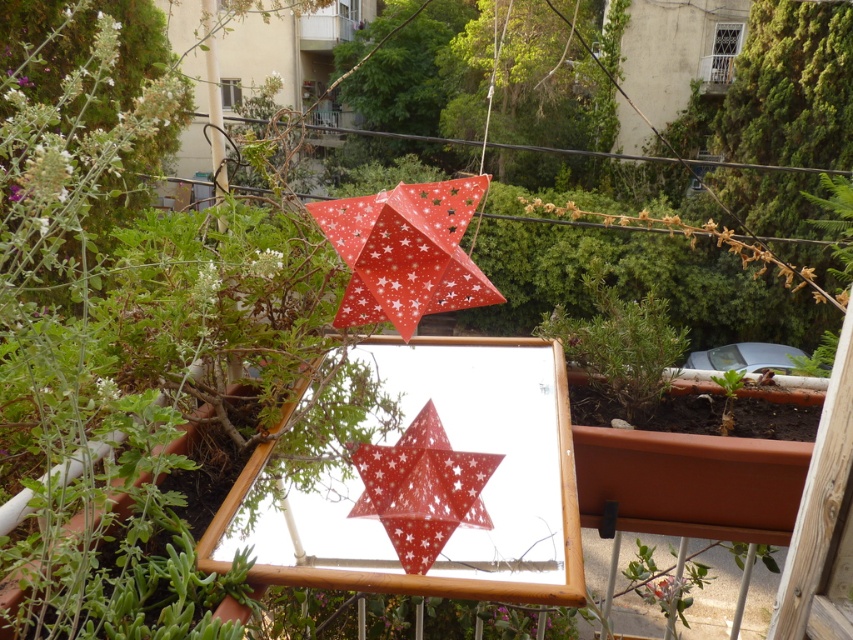
Is red paper star at upper center below green leafy plant at center?

Yes, red paper star at upper center is below green leafy plant at center.

Can you confirm if red paper star at upper center is smaller than green leafy plant at center?

Yes, red paper star at upper center is smaller than green leafy plant at center.

Is point (409, 422) less distant than point (590, 364)?

Yes, it is in front of point (590, 364).

Identify the location of red paper star at upper center. (421, 488).